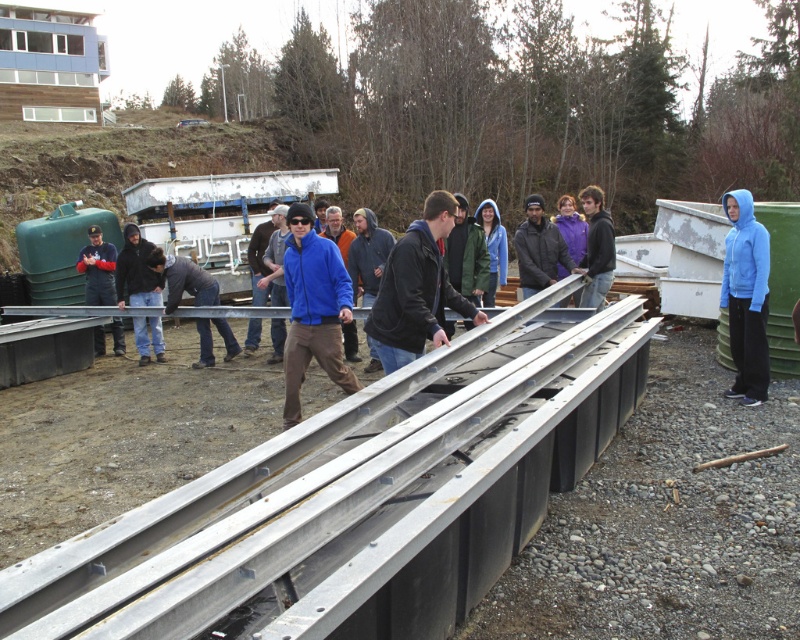
You are a construction worker wearing a blue fleece jacket at center. You need to lift a heavy object placed on the silver metallic rail at center. Considering their heights, can you comfortably reach the object without bending down?

The silver metallic rail at center is not as tall as the blue fleece jacket at center, meaning the rail is shorter than your height. Since the rail is lower than your height, you can comfortably reach the object without bending down.